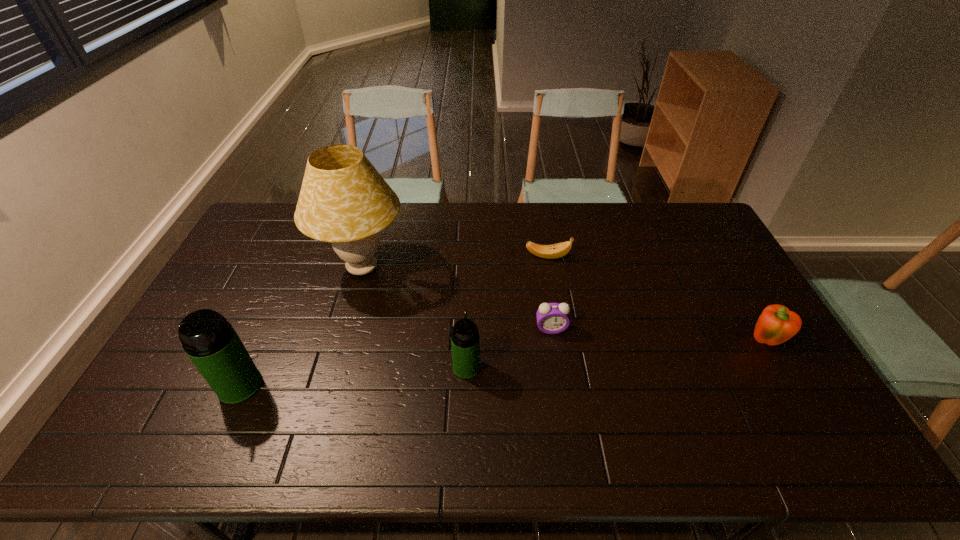
The width and height of the screenshot is (960, 540). I want to click on vacant region located from the spout of the right thermos bottle, so click(468, 281).

What are the coordinates of `vacant area situated from the spout of the right thermos bottle` in the screenshot? It's located at (468, 313).

Image resolution: width=960 pixels, height=540 pixels. I want to click on free space located from the spout of the right thermos bottle, so click(x=468, y=285).

At what (x,y) coordinates should I click in order to perform the action: click on free space located on the front of the tallest object. Please return your answer as a coordinate pair (x, y). The height and width of the screenshot is (540, 960). Looking at the image, I should click on (346, 330).

Locate an element on the screen. free point located 0.300m on the back of the banana is located at coordinates (539, 202).

I want to click on vacant space located 0.200m on the face of the alarm clock, so click(561, 395).

The height and width of the screenshot is (540, 960). I want to click on free space located on the left of the rightmost object, so click(x=659, y=342).

Image resolution: width=960 pixels, height=540 pixels. I want to click on object located in the far edge section of the desktop, so click(x=344, y=200).

At what (x,y) coordinates should I click in order to perform the action: click on object at the near edge. Please return your answer as a coordinate pair (x, y). This screenshot has width=960, height=540. Looking at the image, I should click on (210, 341).

Find the location of `object located at the right edge`. object located at the right edge is located at coordinates (777, 324).